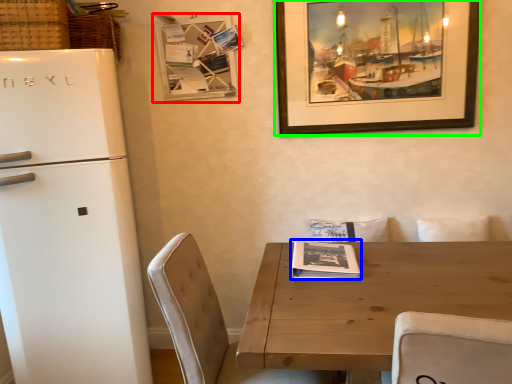
Question: Considering the real-world distances, which object is closest to bulletin board (highlighted by a red box)? magazine (highlighted by a blue box) or picture frame (highlighted by a green box).

Choices:
 (A) magazine
 (B) picture frame

Answer: (B)